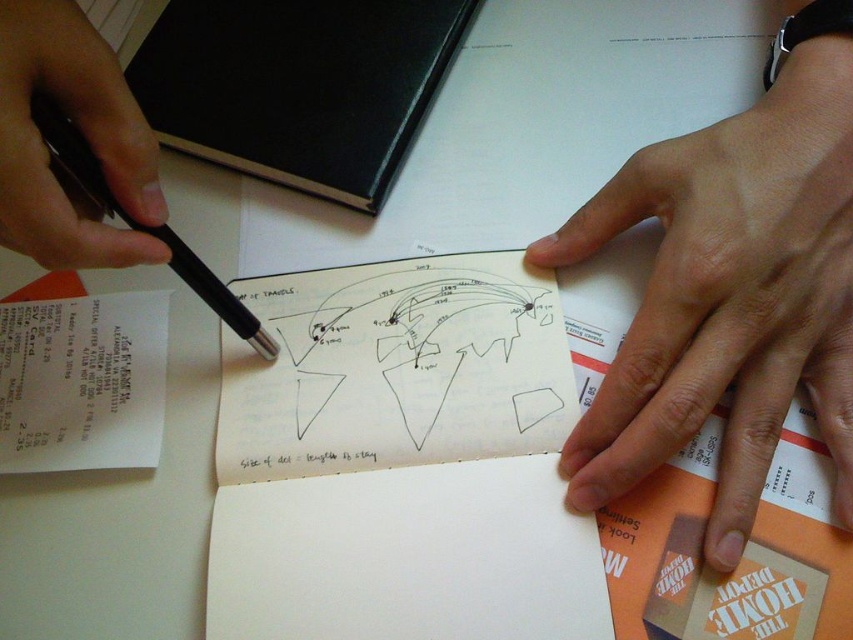
You are organizing a stationery drawer and need to place the black paper at center and the black metallic pen at left. If the drawer has a width of 10 cm, can both items fit side by side?

The black paper at center might be wider than black metallic pen at left, so it is uncertain if both can fit in a 10 cm drawer. Measure their combined width to confirm.

You are a person with a 16 inch long ruler. You want to measure the distance from your eyes to the point at coordinates point (413,432). Can you do it with your ruler?

The distance of point (413,432) from viewer is 18.58 inches. Since your ruler is 16 inches long, it is not long enough to measure the distance to the point (413,432).

You are an artist trying to organize your workspace. You have a black paper at center and a black metallic pen at left. Which object is taller?

The black paper at center is taller than the black metallic pen at left.